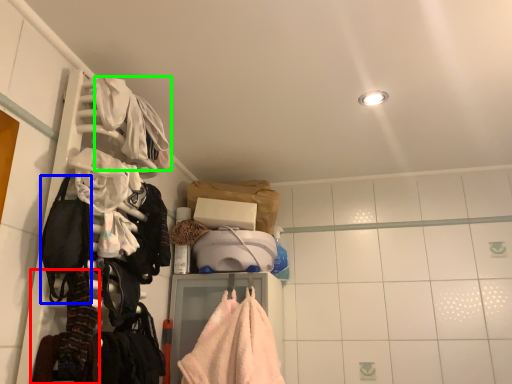
Question: Which object is the closest to the clothing (highlighted by a red box)? Choose among these: gear (highlighted by a blue box) or clothing (highlighted by a green box).

Choices:
 (A) gear
 (B) clothing

Answer: (A)